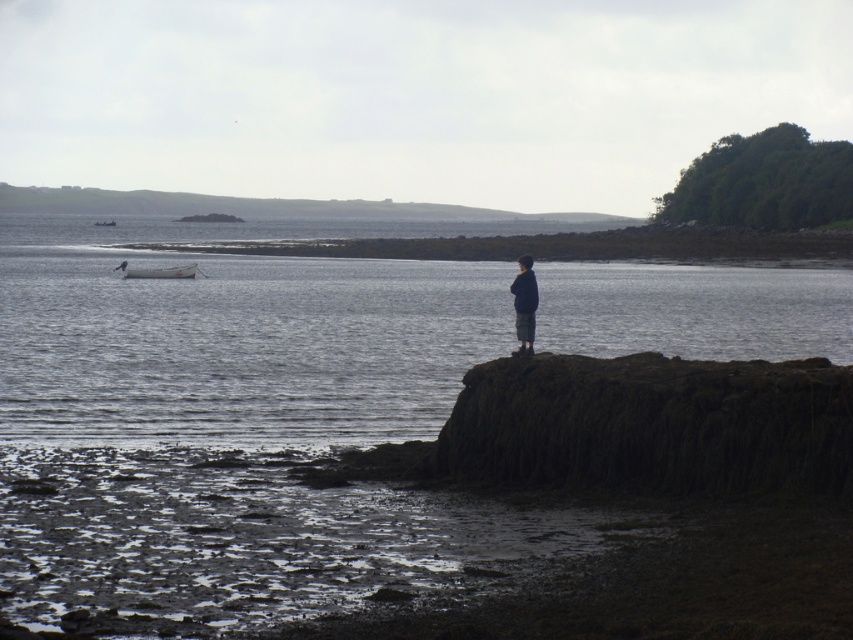
You are standing at the point labeled point (476, 332) and want to walk to the point labeled point (100, 221). Given that you can only move along the shoreline, which direction should you head?

Since point (476, 332) is closer to the viewer than point (100, 221), you should head towards the lower right direction to reach point (100, 221) along the shoreline.

You are a photographer positioned at the camera location in the coastal scene. You want to take a photo focusing on the two points marked in the image. Which point, point (518, 289) or point (106, 225), is closer to the camera?

Point (518, 289) is closer to the camera than point (106, 225).

You are a photographer standing at the edge of the rocky shoreline in the coastal scene. You want to capture a photo that includes both the person on the mossy rock and the small boat in the water. Based on the coordinates provided, which point is closer to you, point (247, 276) or point (163, 275)?

Point (163, 275) is closer to you than point (247, 276) because the description states that point (247, 276) is further away from the viewer.